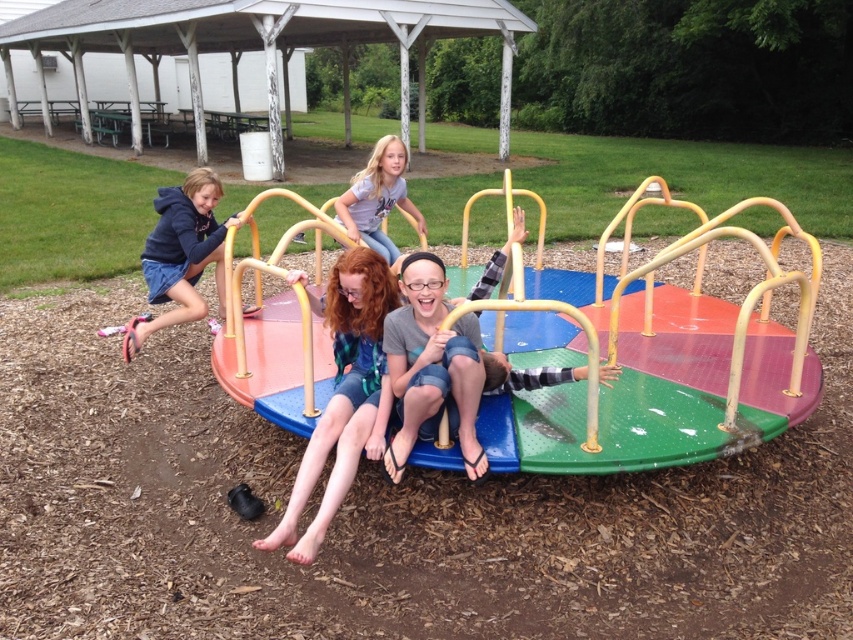
Is point (219, 300) farther from viewer compared to point (381, 196)?

Yes, point (219, 300) is farther from viewer.

Can you confirm if matte black hoodie at left is shorter than light gray t-shirt at center?

No.

Who is more distant from viewer, [178,220] or [387,205]?

The point [387,205] is behind.

In order to click on matte black hoodie at left in this screenshot , I will do `click(181, 253)`.

Consider the image. Is matte green dress at center thinner than light gray t-shirt at center?

Yes, matte green dress at center is thinner than light gray t-shirt at center.

Is matte green dress at center to the left of light gray t-shirt at center from the viewer's perspective?

Yes, matte green dress at center is to the left of light gray t-shirt at center.

Locate an element on the screen. This screenshot has height=640, width=853. matte green dress at center is located at coordinates (343, 394).

From the picture: Is matte green dress at center above matte black hoodie at left?

Actually, matte green dress at center is below matte black hoodie at left.

Can you confirm if matte green dress at center is positioned to the right of matte black hoodie at left?

Yes, matte green dress at center is to the right of matte black hoodie at left.

Is point (309, 305) closer to viewer compared to point (210, 189)?

Yes, point (309, 305) is in front of point (210, 189).

Find the location of a particular element. matte green dress at center is located at coordinates (343, 394).